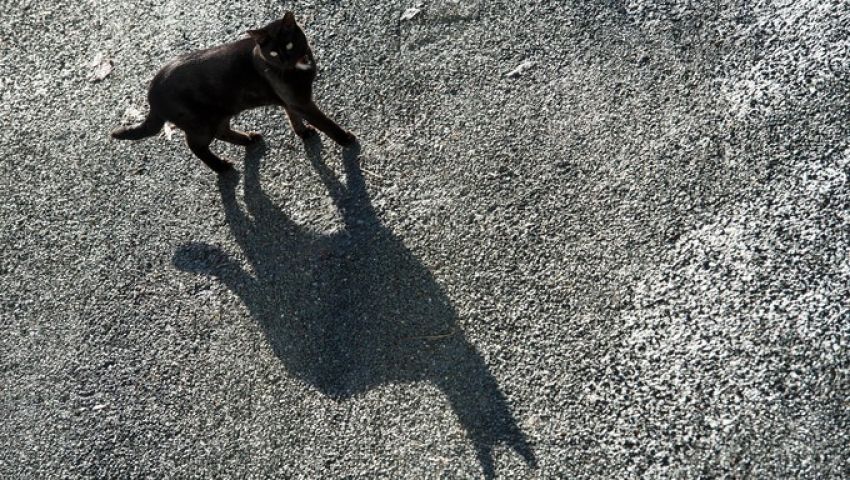
Image resolution: width=850 pixels, height=480 pixels. I want to click on four black legs, so click(194, 149), click(233, 138), click(298, 127), click(336, 133).